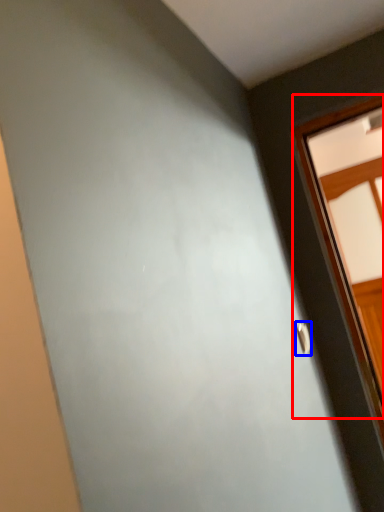
Question: Which object is closer to the camera taking this photo, window (highlighted by a red box) or door handle (highlighted by a blue box)?

Choices:
 (A) window
 (B) door handle

Answer: (B)